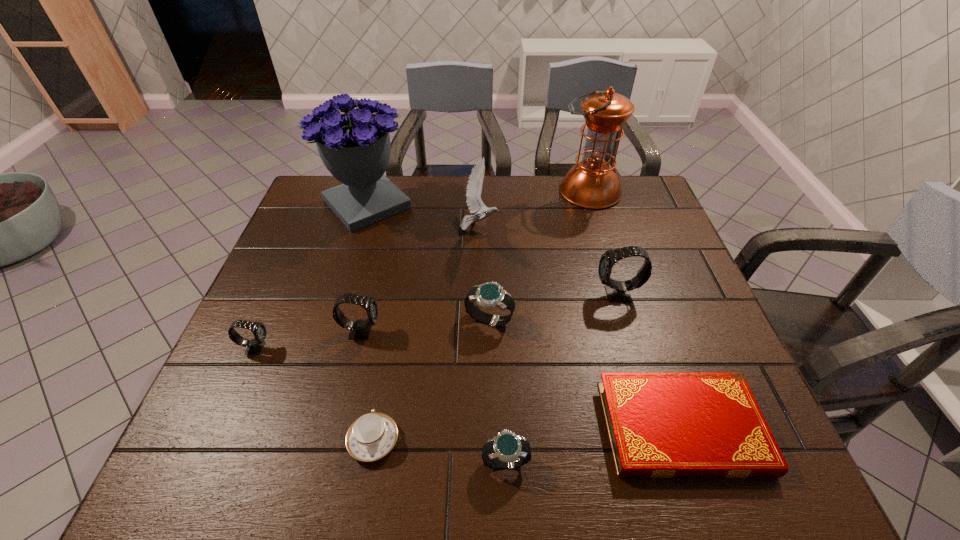
Where is `vacant region located on the face of the farthest gray watch`? vacant region located on the face of the farthest gray watch is located at coordinates (451, 294).

Image resolution: width=960 pixels, height=540 pixels. I want to click on free space located 0.300m on the face of the second watch from left to right, so click(x=507, y=331).

Where is `vacant space located 0.170m on the left of the farther silver watch`? vacant space located 0.170m on the left of the farther silver watch is located at coordinates (396, 319).

The width and height of the screenshot is (960, 540). In order to click on vacant space situated 0.380m on the face of the leftmost gray watch in this screenshot , I will do `click(436, 348)`.

Find the location of a particular element. vacant region located 0.290m on the right of the shortest watch is located at coordinates (683, 461).

What are the coordinates of `free location located on the side with the handle of the blue teacup` in the screenshot? It's located at (402, 278).

This screenshot has height=540, width=960. What are the coordinates of `free region located on the side with the handle of the blue teacup` in the screenshot? It's located at (382, 390).

Locate an element on the screen. vacant space situated 0.250m on the side with the handle of the blue teacup is located at coordinates (395, 321).

Where is `vacant position located on the cover of the hardback book`? Image resolution: width=960 pixels, height=540 pixels. vacant position located on the cover of the hardback book is located at coordinates (446, 428).

The image size is (960, 540). I want to click on vacant space situated 0.390m on the cover of the hardback book, so click(x=412, y=428).